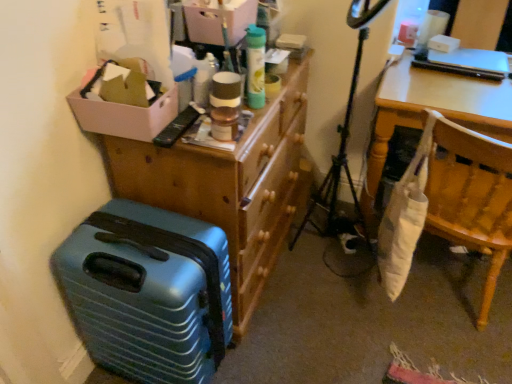
I want to click on blank space situated above white cardboard box at upper left (from a real-world perspective), so click(x=129, y=92).